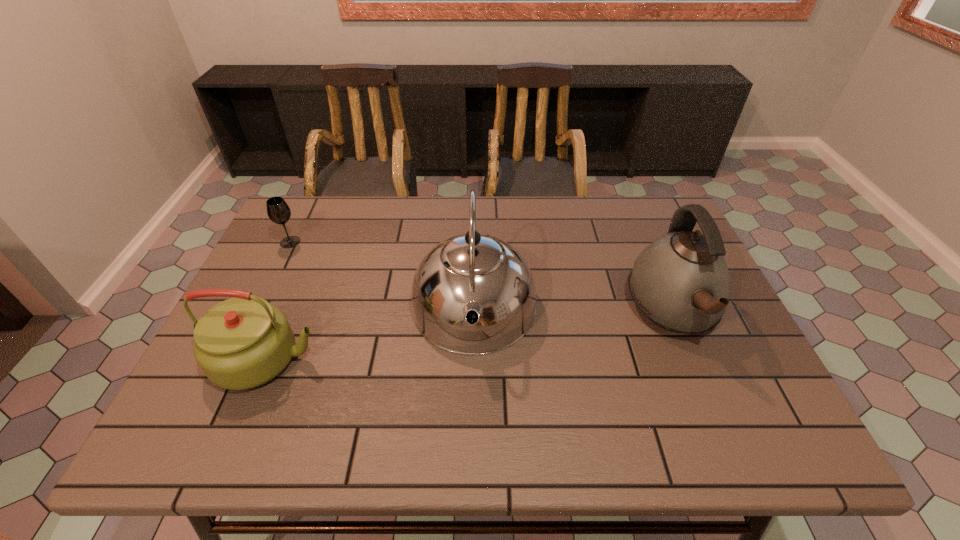
Choose which object is the second nearest neighbor to the second kettle from right to left. Please provide its 2D coordinates. Your answer should be formatted as a tuple, i.e. [(x, y)], where the tuple contains the x and y coordinates of a point satisfying the conditions above.

[(681, 282)]

Identify the location of object that ranks as the second closest to the shortest object. (473, 294).

Locate which kettle is the closest to the rightmost object. Please provide its 2D coordinates. Your answer should be formatted as a tuple, i.e. [(x, y)], where the tuple contains the x and y coordinates of a point satisfying the conditions above.

[(473, 294)]

Point out which kettle is positioned as the nearest to the shortest object. Please provide its 2D coordinates. Your answer should be formatted as a tuple, i.e. [(x, y)], where the tuple contains the x and y coordinates of a point satisfying the conditions above.

[(241, 343)]

Locate an element on the screen. vacant region that satisfies the following two spatial constraints: 1. from the spout of the second kettle from right to left; 2. at the spout of the second shortest object is located at coordinates (473, 359).

The image size is (960, 540). I want to click on free spot that satisfies the following two spatial constraints: 1. at the spout of the rightmost kettle; 2. at the spout of the second shortest object, so click(693, 359).

Identify the location of free spot that satisfies the following two spatial constraints: 1. at the spout of the rightmost object; 2. at the spout of the shortest kettle. (693, 359).

The height and width of the screenshot is (540, 960). I want to click on vacant space that satisfies the following two spatial constraints: 1. at the spout of the rightmost object; 2. at the spout of the leftmost kettle, so click(693, 359).